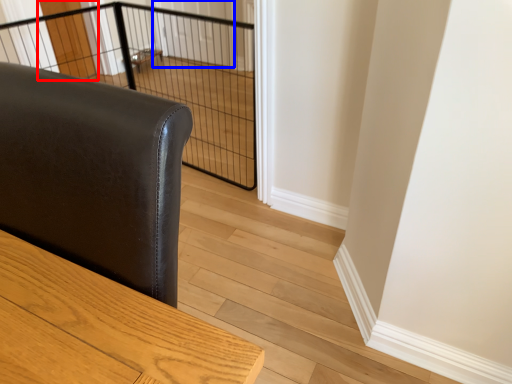
Question: Which of the following is the farthest to the observer, screen door (highlighted by a red box) or screen door (highlighted by a blue box)?

Choices:
 (A) screen door
 (B) screen door

Answer: (B)